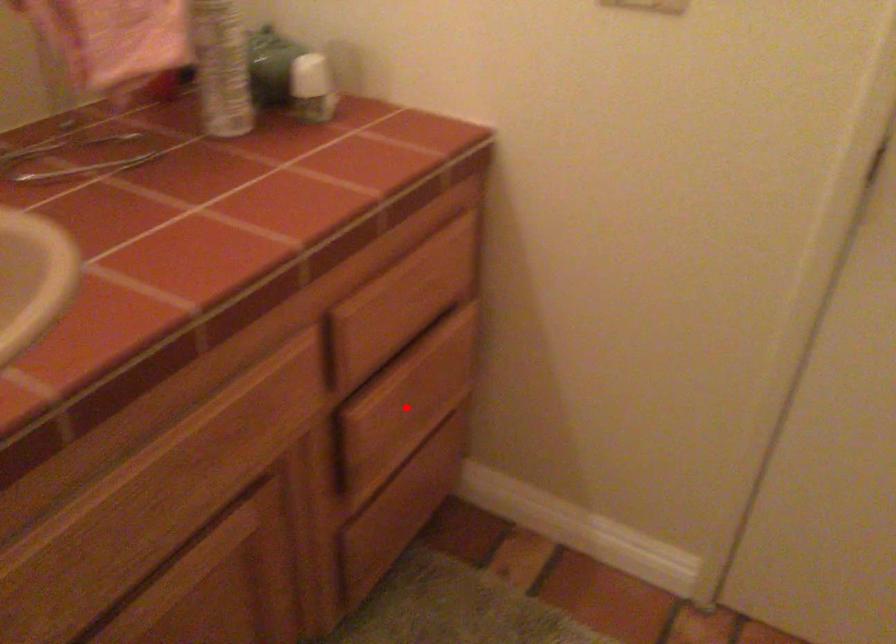
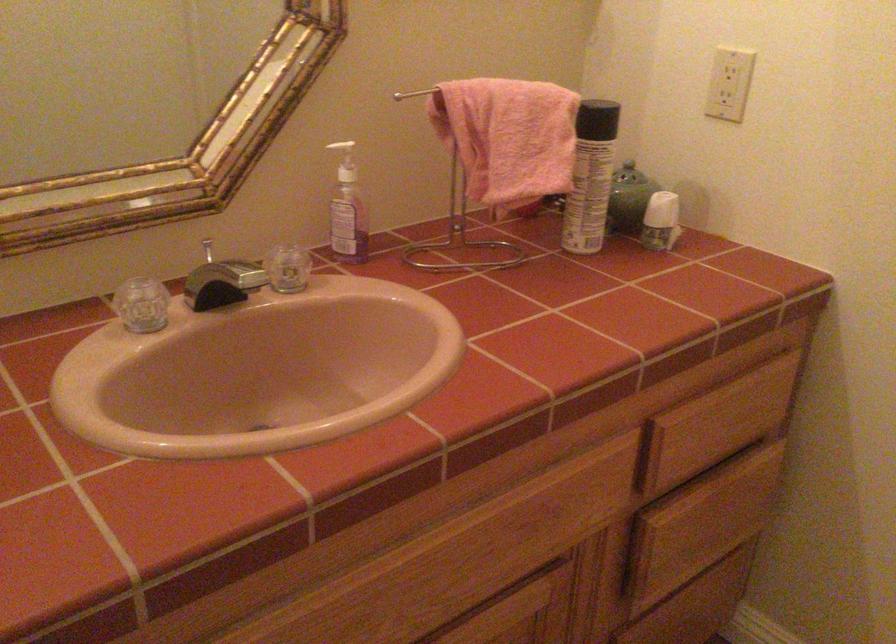
Locate, in the second image, the point that corresponds to the highlighted location in the first image.

(701, 524)